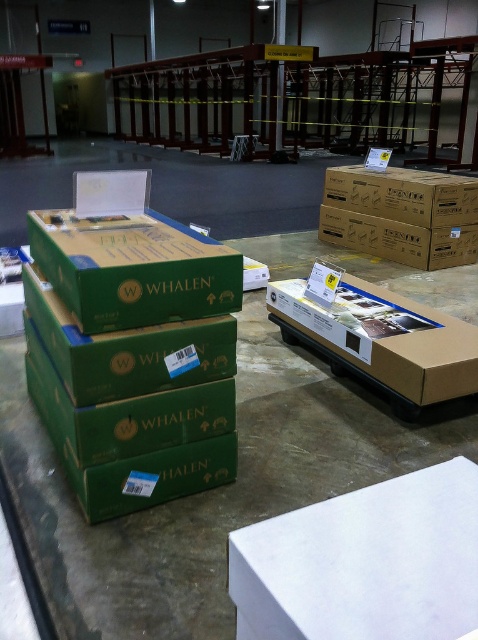
Who is more forward, (431, 324) or (474, 246)?

Point (431, 324) is in front.

How far apart are matte cardboard box at center and brown cardboard box at upper right?

They are 6.21 feet apart.

Which is in front, point (421, 376) or point (443, 244)?

Positioned in front is point (421, 376).

I want to click on matte cardboard box at center, so click(x=382, y=339).

Who is shorter, green cardboard box at center or matte cardboard box at center?

matte cardboard box at center

Image resolution: width=478 pixels, height=640 pixels. Identify the location of green cardboard box at center. (131, 346).

The image size is (478, 640). I want to click on green cardboard box at center, so click(x=131, y=346).

Can you confirm if green cardboard box at center is shorter than brown cardboard box at upper right?

In fact, green cardboard box at center may be taller than brown cardboard box at upper right.

Does point (44, 387) come behind point (422, 230)?

No, it is in front of (422, 230).

Measure the distance between point (97, 340) and camera.

Point (97, 340) is 4.65 feet away from camera.

At what (x,y) coordinates should I click in order to perform the action: click on green cardboard box at center. Please return your answer as a coordinate pair (x, y). Image resolution: width=478 pixels, height=640 pixels. Looking at the image, I should click on (131, 346).